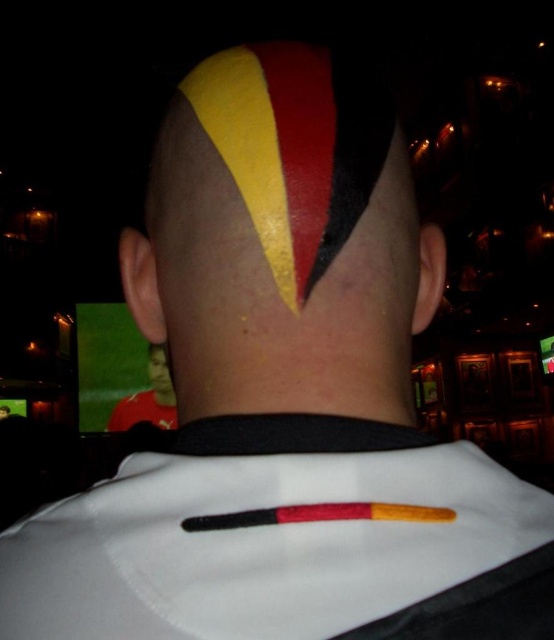
You are an artist observing the back of a person in the image. You notice a black wood crayon at center and a matte yellow face at center. Which object is covering the other?

The black wood crayon at center is positioned over matte yellow face at center, so it is covering the matte yellow face at center.